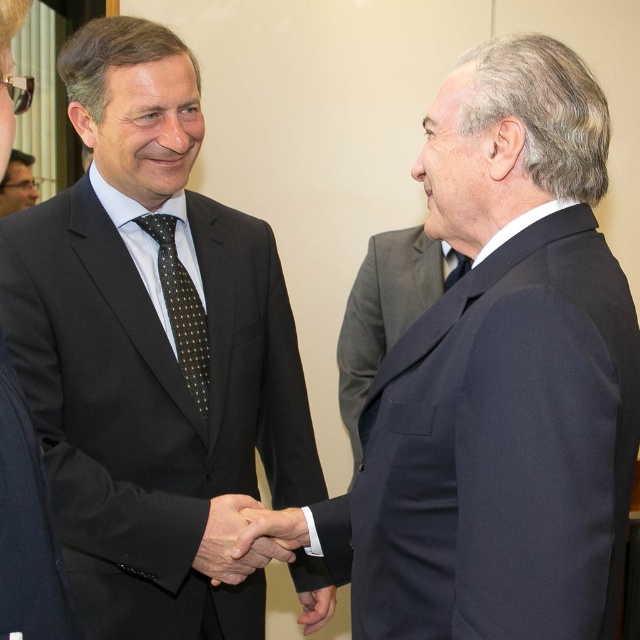
Is matte black suit at center to the right of matte black suit at upper left from the viewer's perspective?

Indeed, matte black suit at center is positioned on the right side of matte black suit at upper left.

Does matte black suit at center appear under matte black suit at upper left?

Yes.

Does point (113, 472) come farther from viewer compared to point (12, 154)?

No, (113, 472) is closer to viewer.

Where is `matte black suit at center`? matte black suit at center is located at coordinates (154, 403).

Between navy wool suit at right and matte black suit at center, which one is positioned higher?

matte black suit at center is above.

Does navy wool suit at right have a greater width compared to matte black suit at center?

In fact, navy wool suit at right might be narrower than matte black suit at center.

Image resolution: width=640 pixels, height=640 pixels. What do you see at coordinates (497, 451) in the screenshot?
I see `navy wool suit at right` at bounding box center [497, 451].

What are the coordinates of `navy wool suit at right` in the screenshot? It's located at coord(497,451).

Between point (404, 577) and point (465, 266), which one is positioned in front?

Point (404, 577)

Does navy wool suit at right appear on the right side of matte black tie at center?

In fact, navy wool suit at right is to the left of matte black tie at center.

Is point (468, 528) closer to viewer compared to point (445, 257)?

Yes, it is in front of point (445, 257).

The height and width of the screenshot is (640, 640). I want to click on navy wool suit at right, so click(497, 451).